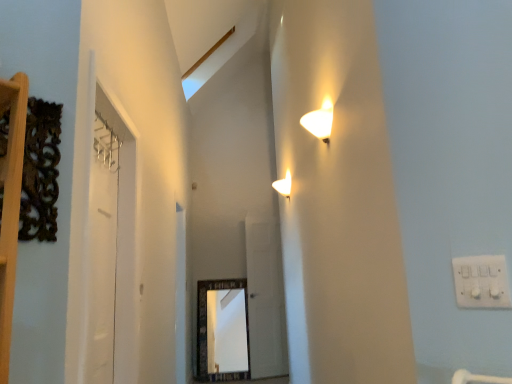
Question: Is clear glass door at left, the second glass door positioned from the back, completely or partially inside transparent glass door at center, placed as the 1th glass door when sorted from back to front?

Choices:
 (A) no
 (B) yes

Answer: (A)

Question: From the image's perspective, does transparent glass door at center, placed as the 1th glass door when sorted from back to front, appear higher than clear glass door at left, which is counted as the 1th glass door, starting from the left?

Choices:
 (A) no
 (B) yes

Answer: (A)

Question: Is transparent glass door at center, the first glass door viewed from the right, positioned beyond the bounds of clear glass door at left, which is counted as the 1th glass door, starting from the left?

Choices:
 (A) no
 (B) yes

Answer: (B)

Question: Could you tell me if transparent glass door at center, the second glass door in the front-to-back sequence, is turned towards clear glass door at left, which appears as the 1th glass door when viewed from the front?

Choices:
 (A) no
 (B) yes

Answer: (A)

Question: From the image's perspective, would you say transparent glass door at center, the first glass door viewed from the right, is shown under clear glass door at left, which is counted as the 1th glass door, starting from the left?

Choices:
 (A) no
 (B) yes

Answer: (B)

Question: From the image's perspective, is transparent glass door at center, placed as the 1th glass door when sorted from back to front, located above or below white plastic electric outlet at upper right?

Choices:
 (A) below
 (B) above

Answer: (A)

Question: Considering the positions of transparent glass door at center, placed as the 1th glass door when sorted from back to front, and white plastic electric outlet at upper right in the image, is transparent glass door at center, placed as the 1th glass door when sorted from back to front, wider or thinner than white plastic electric outlet at upper right?

Choices:
 (A) thin
 (B) wide

Answer: (B)

Question: In terms of size, does transparent glass door at center, which is the second glass door from left to right, appear bigger or smaller than white plastic electric outlet at upper right?

Choices:
 (A) big
 (B) small

Answer: (A)

Question: From their relative heights in the image, would you say transparent glass door at center, the first glass door viewed from the right, is taller or shorter than white plastic electric outlet at upper right?

Choices:
 (A) short
 (B) tall

Answer: (B)

Question: Based on their positions, is clear glass door at left, arranged as the 2th glass door when viewed from the right, located to the left or right of transparent glass door at center, the second glass door in the front-to-back sequence?

Choices:
 (A) left
 (B) right

Answer: (A)

Question: In the image, is clear glass door at left, which is counted as the 1th glass door, starting from the left, positioned in front of or behind transparent glass door at center, the second glass door in the front-to-back sequence?

Choices:
 (A) behind
 (B) front

Answer: (B)

Question: From the image's perspective, relative to transparent glass door at center, the second glass door in the front-to-back sequence, is clear glass door at left, arranged as the 2th glass door when viewed from the right, above or below?

Choices:
 (A) below
 (B) above

Answer: (B)

Question: Considering the positions of point (76, 251) and point (257, 279), is point (76, 251) closer or farther from the camera than point (257, 279)?

Choices:
 (A) farther
 (B) closer

Answer: (B)

Question: From a real-world perspective, is transparent glass door at center, placed as the 1th glass door when sorted from back to front, above or below white glossy wall sconce at upper center?

Choices:
 (A) below
 (B) above

Answer: (A)

Question: Considering the relative positions of transparent glass door at center, placed as the 1th glass door when sorted from back to front, and white glossy wall sconce at upper center in the image provided, is transparent glass door at center, placed as the 1th glass door when sorted from back to front, to the left or to the right of white glossy wall sconce at upper center?

Choices:
 (A) left
 (B) right

Answer: (A)